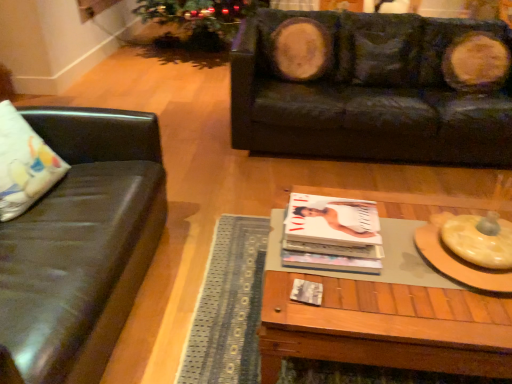
Question: Based on their sizes in the image, would you say black leather couch at upper right, arranged as the first studio couch when viewed from the right, is bigger or smaller than matte white magazine at center?

Choices:
 (A) small
 (B) big

Answer: (B)

Question: Looking at their shapes, would you say black leather couch at upper right, which appears as the first studio couch when viewed from the back, is wider or thinner than matte white magazine at center?

Choices:
 (A) wide
 (B) thin

Answer: (A)

Question: Based on their relative distances, which object is nearer to the black leather couch at upper right, which appears as the first studio couch when viewed from the back?

Choices:
 (A) woodenwoodencoffee table at center
 (B) matte black couch at left, which is the 2th studio couch in back-to-front order
 (C) white fabric pillow at left
 (D) matte white magazine at center

Answer: (A)

Question: Which is nearer to the matte white magazine at center?

Choices:
 (A) matte black couch at left, the 1th studio couch in the front-to-back sequence
 (B) white fabric pillow at left
 (C) woodenwoodencoffee table at center
 (D) black leather couch at upper right, which ranks as the 2th studio couch in front-to-back order

Answer: (C)